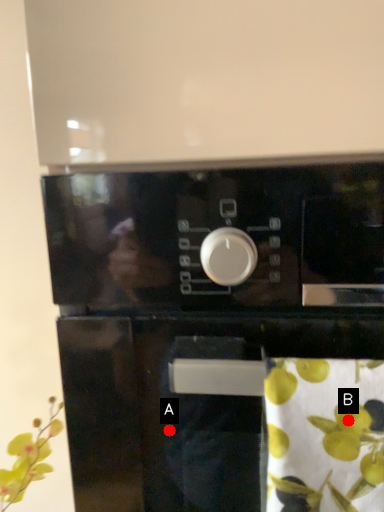
Question: Two points are circled on the image, labeled by A and B beside each circle. Among these points, which one is nearest to the camera?

Choices:
 (A) A is closer
 (B) B is closer

Answer: (B)